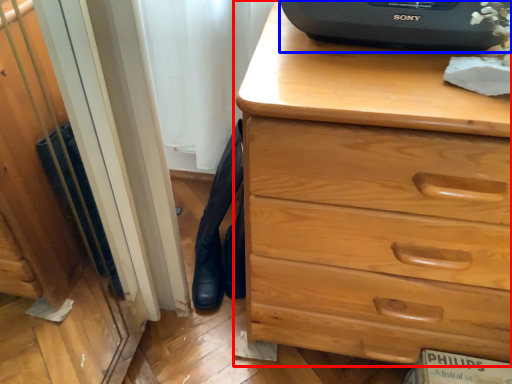
Question: Among these objects, which one is nearest to the camera, chest of drawers (highlighted by a red box) or desktop computer (highlighted by a blue box)?

Choices:
 (A) chest of drawers
 (B) desktop computer

Answer: (A)